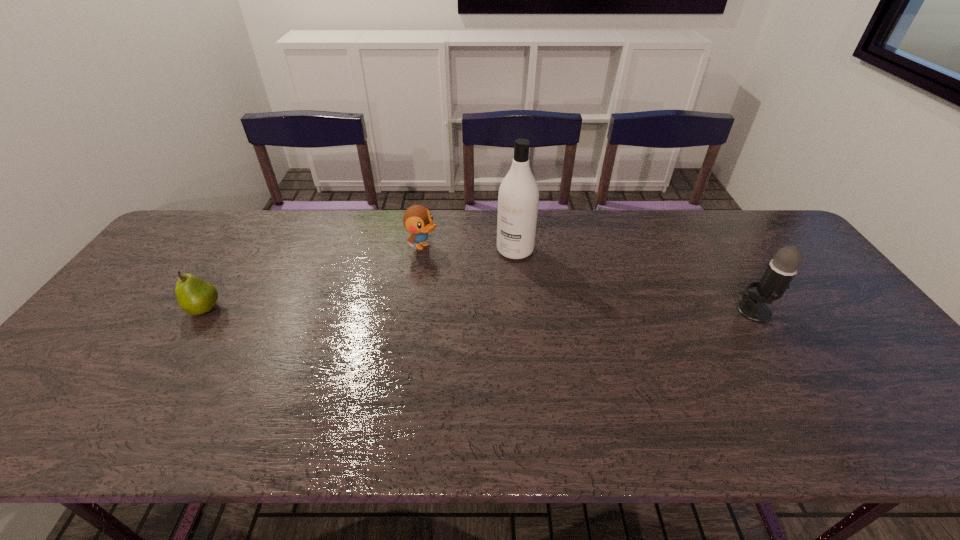
You are a GUI agent. You are given a task and a screenshot of the screen. Output one action in this format:
    pyautogui.click(x=<x>, y=<y>)
    Task: Click on the free space located 0.350m on the front-facing side of the duck
    This screenshot has height=540, width=960.
    Given the screenshot: What is the action you would take?
    pyautogui.click(x=530, y=299)

The height and width of the screenshot is (540, 960). Find the location of `vacant area situated on the front-facing side of the tallest object`. vacant area situated on the front-facing side of the tallest object is located at coordinates (437, 348).

Locate an element on the screen. The height and width of the screenshot is (540, 960). vacant area situated 0.110m on the front-facing side of the tallest object is located at coordinates (490, 281).

This screenshot has height=540, width=960. I want to click on vacant space located on the front-facing side of the tallest object, so click(439, 345).

At what (x,y) coordinates should I click in order to perform the action: click on duck positioned at the far edge. Please return your answer as a coordinate pair (x, y). Looking at the image, I should click on (418, 220).

You are a GUI agent. You are given a task and a screenshot of the screen. Output one action in this format:
    pyautogui.click(x=<x>, y=<y>)
    Task: Click on the shampoo located in the far edge section of the desktop
    
    Given the screenshot: What is the action you would take?
    pyautogui.click(x=518, y=198)

The image size is (960, 540). Find the location of `free space at the far edge`. free space at the far edge is located at coordinates (585, 220).

You are a GUI agent. You are given a task and a screenshot of the screen. Output one action in this format:
    pyautogui.click(x=<x>, y=<y>)
    Task: Click on the blank space at the near edge
    
    Given the screenshot: What is the action you would take?
    pyautogui.click(x=346, y=376)

Locate an element on the screen. The image size is (960, 540). free point at the left edge is located at coordinates pos(151,273).

This screenshot has height=540, width=960. I want to click on vacant space at the right edge of the desktop, so click(x=849, y=323).